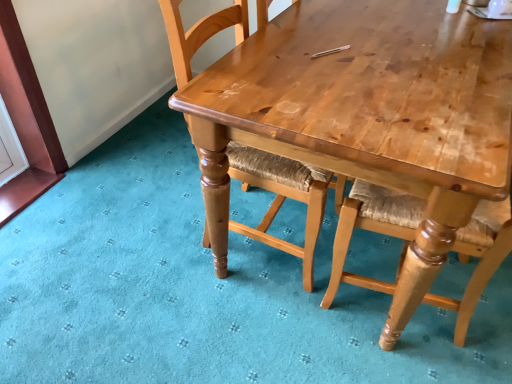
Question: Is light brown wood table at upper center located outside wooden woven seat at center?

Choices:
 (A) no
 (B) yes

Answer: (B)

Question: Is light brown wood table at upper center shorter than wooden woven seat at center?

Choices:
 (A) yes
 (B) no

Answer: (A)

Question: Is light brown wood table at upper center in front of wooden woven seat at center?

Choices:
 (A) yes
 (B) no

Answer: (A)

Question: From the image's perspective, does light brown wood table at upper center appear higher than wooden woven seat at center?

Choices:
 (A) yes
 (B) no

Answer: (B)

Question: Is light brown wood table at upper center surrounding wooden woven seat at center?

Choices:
 (A) no
 (B) yes

Answer: (A)

Question: Does light brown wood table at upper center have a greater height compared to wooden woven seat at center?

Choices:
 (A) no
 (B) yes

Answer: (A)

Question: From a real-world perspective, is wooden woven seat at center physically above light brown wood table at upper center?

Choices:
 (A) yes
 (B) no

Answer: (B)

Question: Is wooden woven seat at center located outside light brown wood table at upper center?

Choices:
 (A) no
 (B) yes

Answer: (B)

Question: Considering the relative sizes of wooden woven seat at center and light brown wood table at upper center in the image provided, is wooden woven seat at center taller than light brown wood table at upper center?

Choices:
 (A) yes
 (B) no

Answer: (A)

Question: Is wooden woven seat at center directly adjacent to light brown wood table at upper center?

Choices:
 (A) yes
 (B) no

Answer: (B)

Question: Is wooden woven seat at center closer to camera compared to light brown wood table at upper center?

Choices:
 (A) no
 (B) yes

Answer: (A)

Question: From the image's perspective, is wooden woven seat at center on light brown wood table at upper center?

Choices:
 (A) no
 (B) yes

Answer: (B)

Question: Is wooden woven seat at center inside or outside of light brown wood table at upper center?

Choices:
 (A) inside
 (B) outside

Answer: (B)